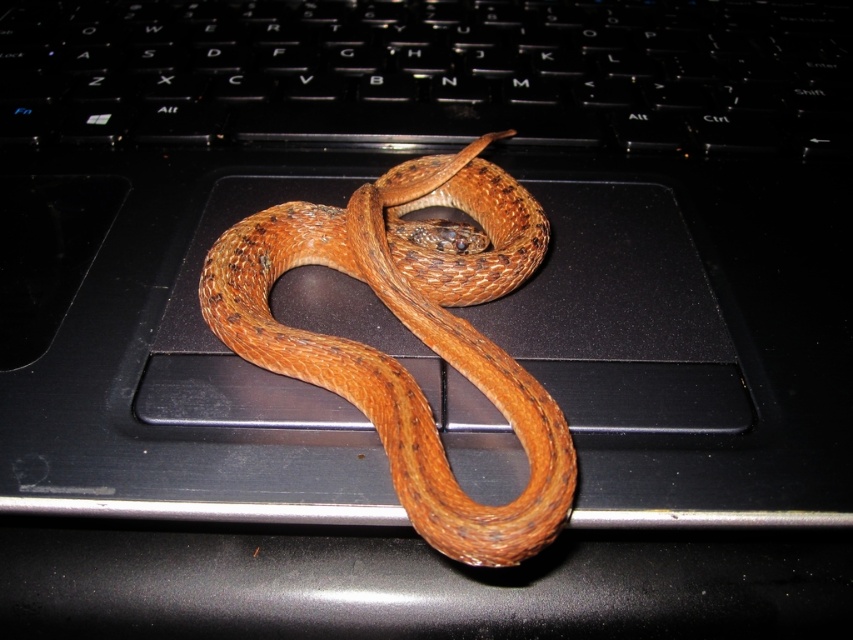
You need to place a protective cover over the black plastic keyboard at center and the brown scaly snake at center. If the cover is exactly the same width as the keyboard, will it also cover the snake?

The black plastic keyboard at center might be wider than brown scaly snake at center, so the cover that matches the keyboard width should cover the snake as well.

You are trying to take a photo of the black plastic keyboard at center but the brown scaly snake at center is blocking it. Can you move the snake to the side to get a clear shot of the keyboard?

The brown scaly snake at center is longer than the black plastic keyboard at center. Since the snake is longer, moving it to the side might require more space, but since the keyboard is shorter, you could carefully slide the snake sideways to expose the keyboard area.

You are a delivery robot that needs to place a package on the black plastic keyboard at center without disturbing the brown scaly snake at center. The robot has a 35 cm arm. Can the robot reach the keyboard from its current position near the snake?

The black plastic keyboard at center is 36.52 centimeters away from the brown scaly snake at center. Since the robot has a 35 cm arm, it cannot reach the keyboard from its current position near the snake.